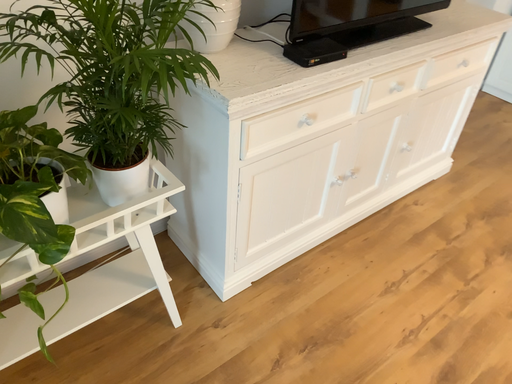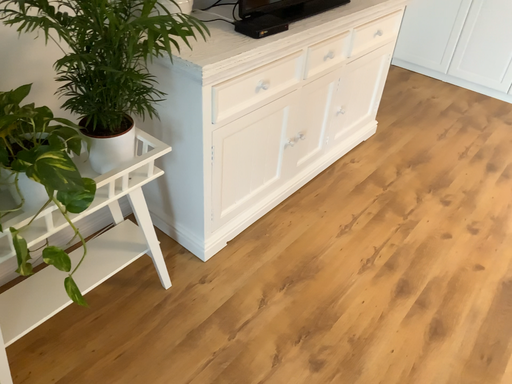
Question: Which way did the camera rotate in the video?

Choices:
 (A) rotated left
 (B) rotated right

Answer: (B)